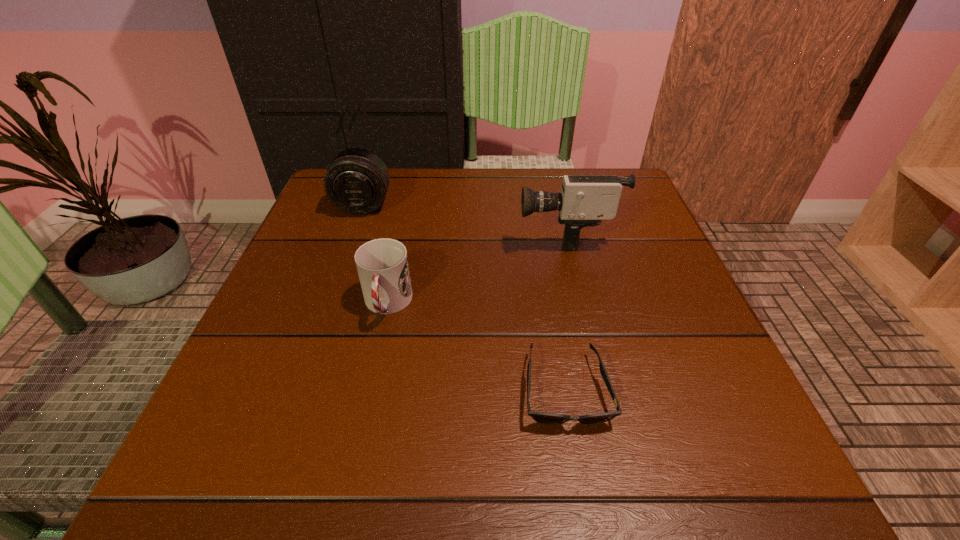
This screenshot has width=960, height=540. Find the location of `free space located on the handle side of the cup`. free space located on the handle side of the cup is located at coordinates (361, 426).

Find the location of a particular element. Image resolution: width=960 pixels, height=540 pixels. vacant region located 0.060m on the front-facing side of the shortest object is located at coordinates (579, 474).

I want to click on camcorder located in the far edge section of the desktop, so click(x=585, y=200).

At what (x,y) coordinates should I click in order to perform the action: click on telephoto lens that is at the far edge. Please return your answer as a coordinate pair (x, y). Looking at the image, I should click on (357, 180).

The width and height of the screenshot is (960, 540). In order to click on object present at the left edge in this screenshot , I will do click(357, 180).

Identify the location of object at the right edge. (585, 200).

Identify the location of object at the far left corner. (357, 180).

I want to click on object located at the far right corner, so click(585, 200).

The image size is (960, 540). I want to click on vacant space at the far edge, so pyautogui.click(x=411, y=215).

This screenshot has width=960, height=540. I want to click on free space at the near edge, so click(x=478, y=435).